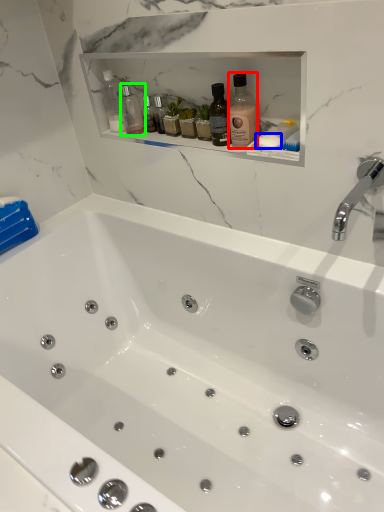
Question: Based on their relative distances, which object is nearer to bottle (highlighted by a red box)? Choose from soap (highlighted by a blue box) and bottle (highlighted by a green box).

Choices:
 (A) soap
 (B) bottle

Answer: (A)